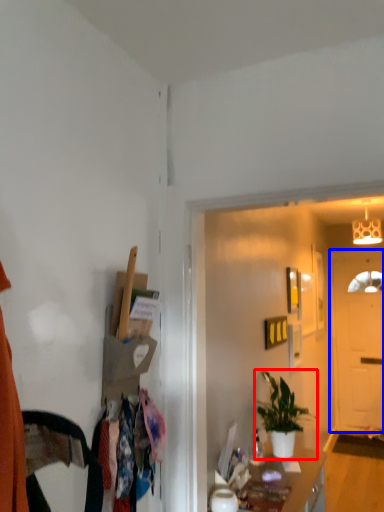
Question: Which object appears closest to the camera in this image, houseplant (highlighted by a red box) or door (highlighted by a blue box)?

Choices:
 (A) houseplant
 (B) door

Answer: (A)